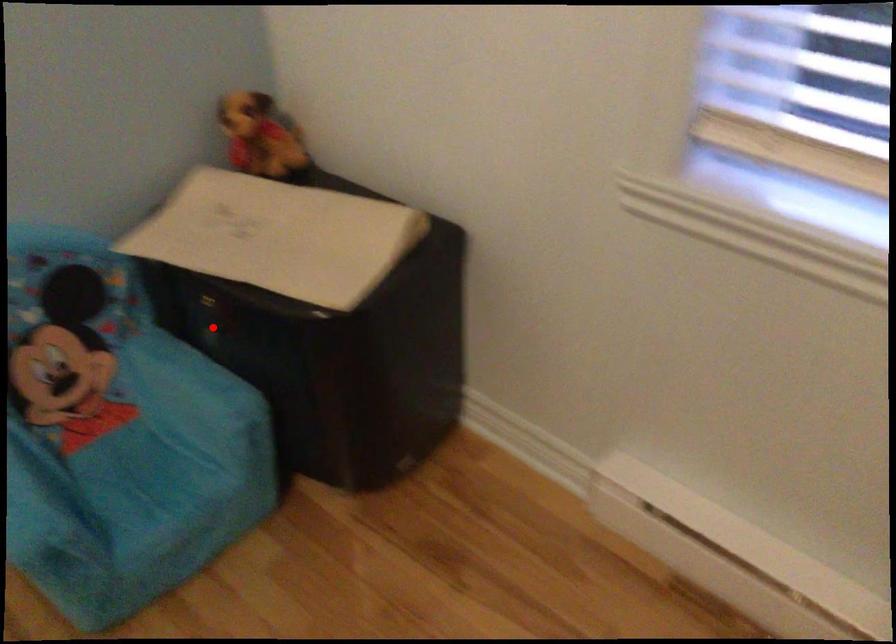
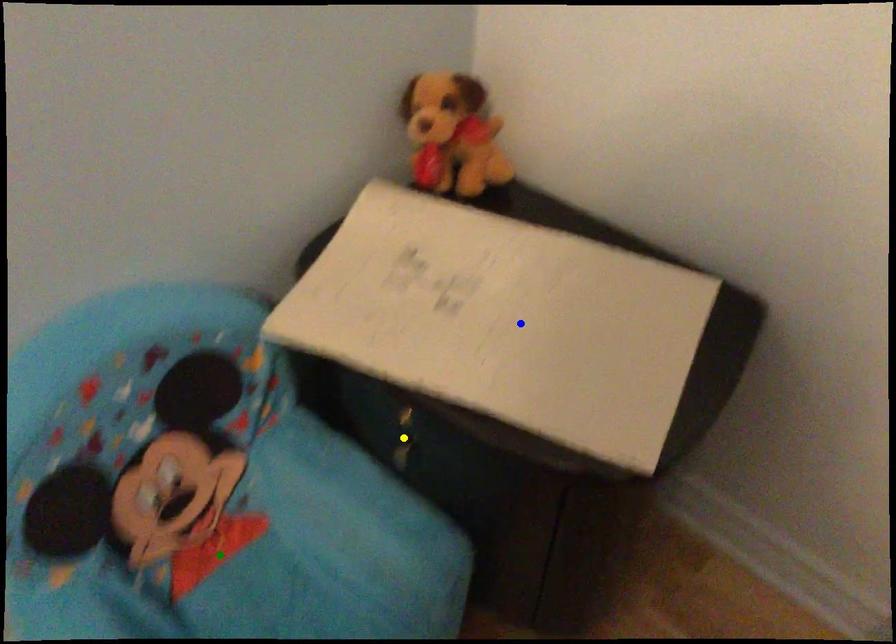
Question: I am providing you with two images of the same scene from different viewpoints. A red point is marked on the first image. You are given multiple points on the second image. In image 2, which mark is for the same physical point as the one in image 1?

Choices:
 (A) yellow point
 (B) blue point
 (C) green point

Answer: (A)